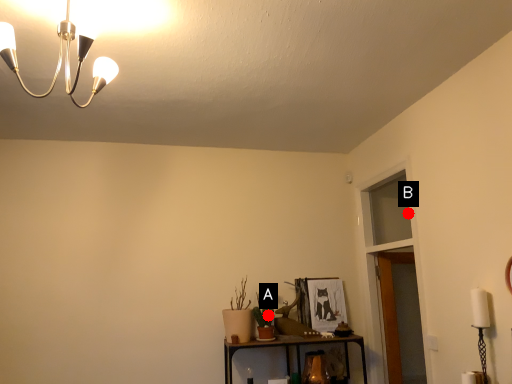
Question: Two points are circled on the image, labeled by A and B beside each circle. Which point appears farthest from the camera in this image?

Choices:
 (A) A is further
 (B) B is further

Answer: (B)